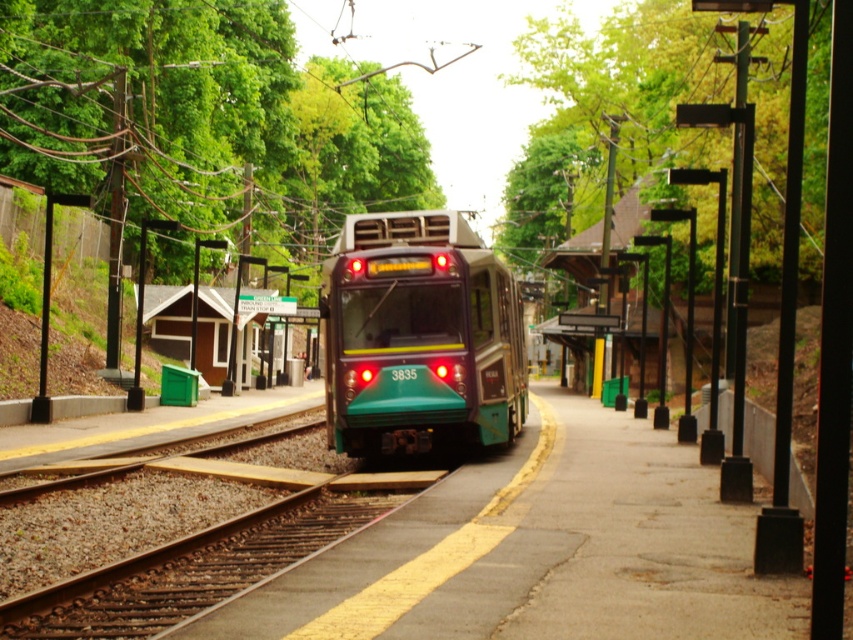
Question: Which object appears farthest from the camera in this image?

Choices:
 (A) green matte train at center
 (B) green metallic track at center

Answer: (A)

Question: Which of the following is the closest to the observer?

Choices:
 (A) green metallic track at center
 (B) green matte train at center

Answer: (A)

Question: Is green matte train at center below green metallic track at center?

Choices:
 (A) no
 (B) yes

Answer: (A)

Question: From the image, what is the correct spatial relationship of green matte train at center in relation to green metallic track at center?

Choices:
 (A) left
 (B) right

Answer: (B)

Question: Does green matte train at center appear on the right side of green metallic track at center?

Choices:
 (A) yes
 (B) no

Answer: (A)